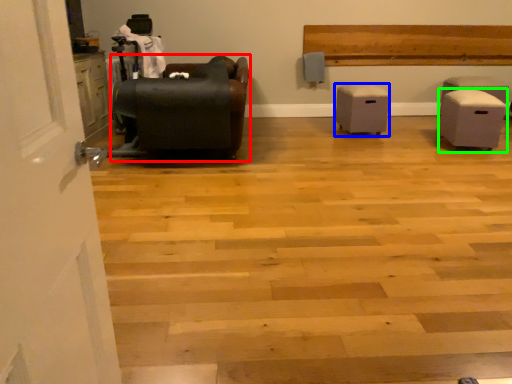
Question: Considering the real-world distances, which object is farthest from furniture (highlighted by a red box)? furniture (highlighted by a blue box) or furniture (highlighted by a green box)?

Choices:
 (A) furniture
 (B) furniture

Answer: (B)